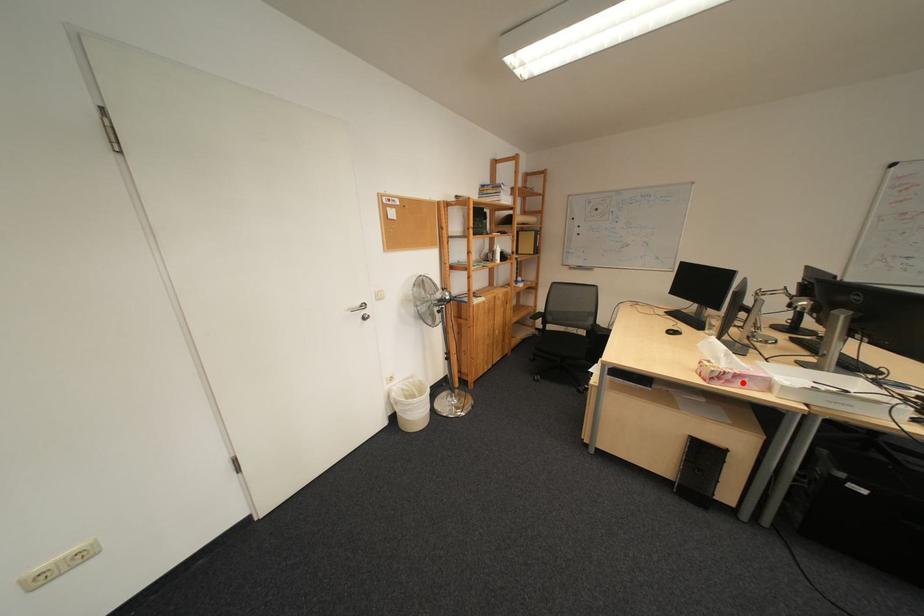
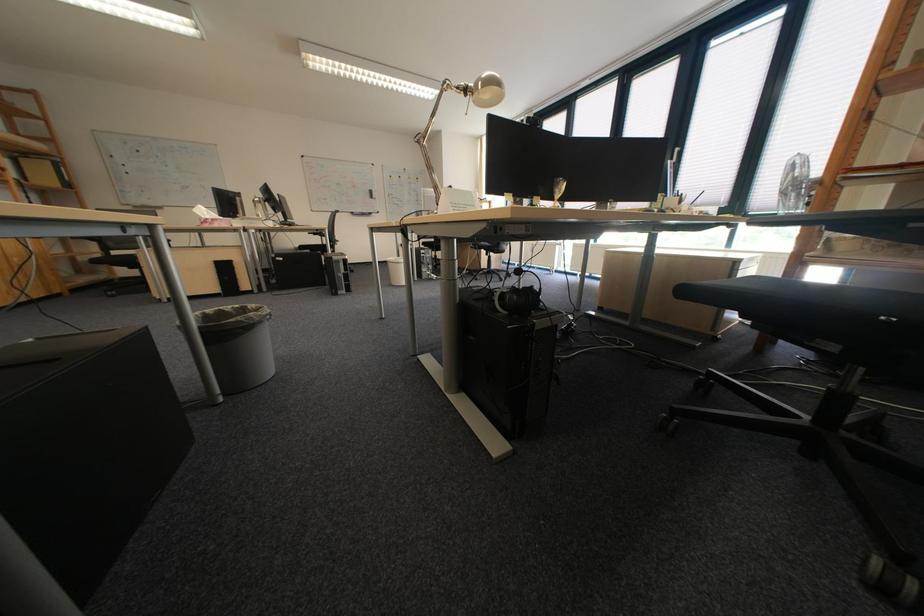
Locate, in the second image, the point that corresponds to the highlighted location in the first image.

(225, 225)